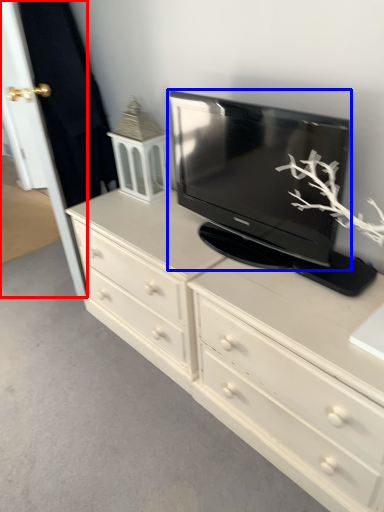
Question: Which object appears farthest to the camera in this image, door (highlighted by a red box) or television (highlighted by a blue box)?

Choices:
 (A) door
 (B) television

Answer: (A)